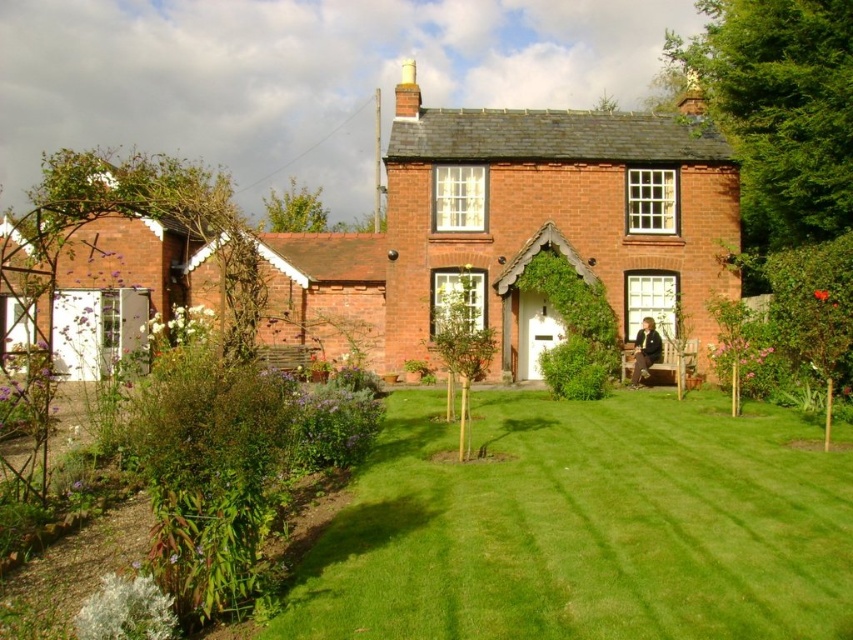
Question: Which of the following is the closest to the observer?

Choices:
 (A) (509, 454)
 (B) (328, 241)

Answer: (A)

Question: Is green smooth lawn at center to the left of red brick cottage at center from the viewer's perspective?

Choices:
 (A) no
 (B) yes

Answer: (A)

Question: Which point appears closest to the camera in this image?

Choices:
 (A) tap(532, 209)
 (B) tap(769, 467)

Answer: (B)

Question: Is green smooth lawn at center positioned behind red brick cottage at center?

Choices:
 (A) yes
 (B) no

Answer: (B)

Question: Does green smooth lawn at center appear on the left side of red brick cottage at center?

Choices:
 (A) no
 (B) yes

Answer: (A)